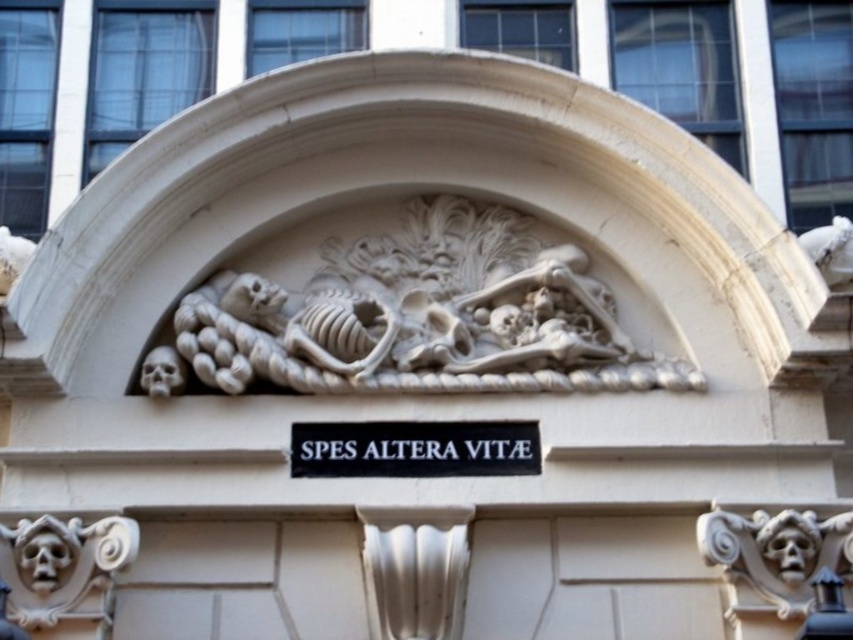
Question: Is white stone skeleton at center thinner than black matte sign at center?

Choices:
 (A) yes
 (B) no

Answer: (B)

Question: Is the position of white stone skeleton at center more distant than that of black matte sign at center?

Choices:
 (A) yes
 (B) no

Answer: (A)

Question: Which of the following is the farthest from the observer?

Choices:
 (A) black matte sign at center
 (B) white stone skeleton at center

Answer: (B)

Question: Which of the following is the farthest from the observer?

Choices:
 (A) black matte sign at center
 (B) white stone skeleton at center

Answer: (B)

Question: Is the position of white stone skeleton at center less distant than that of black matte sign at center?

Choices:
 (A) no
 (B) yes

Answer: (A)